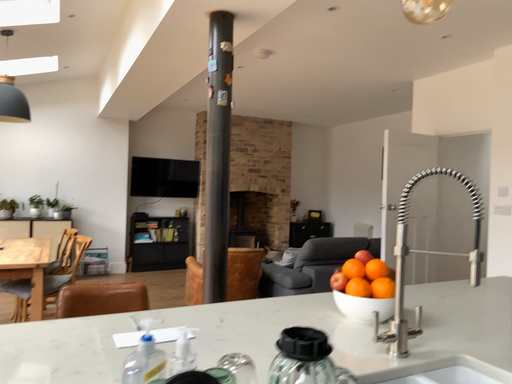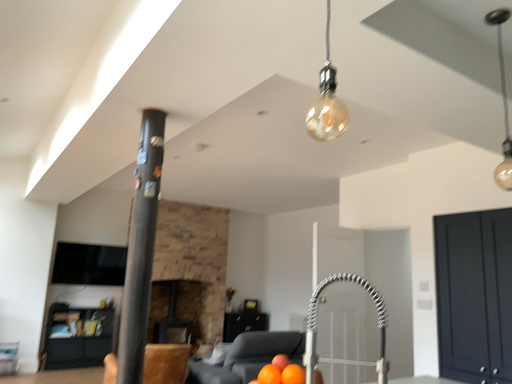
Question: How did the camera likely rotate when shooting the video?

Choices:
 (A) rotated downward
 (B) rotated upward

Answer: (B)